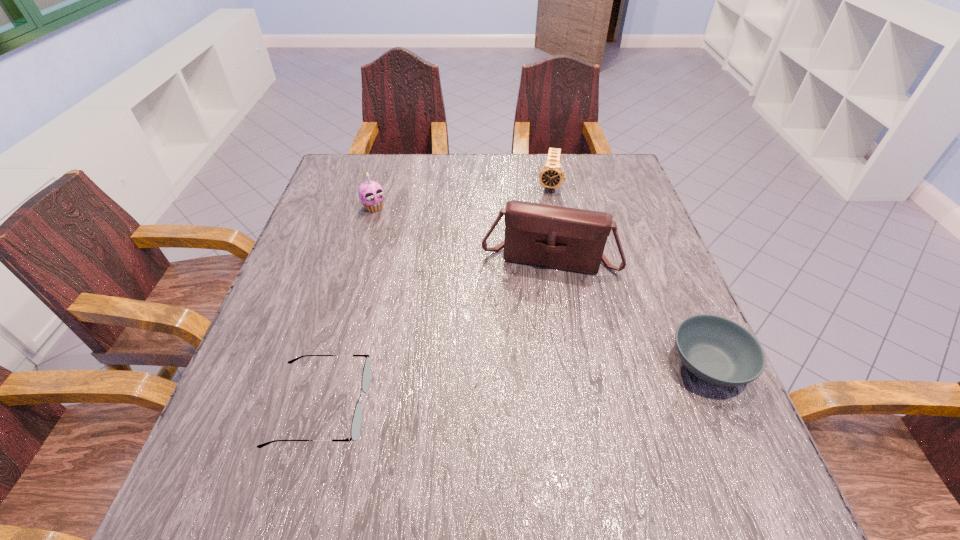
Identify the location of spectacles. (366, 375).

Locate an element on the screen. The height and width of the screenshot is (540, 960). soup bowl is located at coordinates (717, 350).

Where is `the farthest object`? The height and width of the screenshot is (540, 960). the farthest object is located at coordinates (551, 175).

You are a GUI agent. You are given a task and a screenshot of the screen. Output one action in this format:
    pyautogui.click(x=<x>, y=<y>)
    Task: Click on the second farthest object
    Image resolution: width=960 pixels, height=540 pixels.
    Given the screenshot: What is the action you would take?
    pyautogui.click(x=371, y=194)

I want to click on shoulder bag, so click(564, 238).

You are a GUI agent. You are given a task and a screenshot of the screen. Output one action in this format:
    pyautogui.click(x=<x>, y=<y>)
    Task: Click on the tallest object
    The width and height of the screenshot is (960, 540).
    Given the screenshot: What is the action you would take?
    pyautogui.click(x=564, y=238)

The height and width of the screenshot is (540, 960). I want to click on vacant space positioned on the lenses of the spectacles, so click(x=506, y=406).

Find the location of a particular element. This screenshot has height=540, width=960. vacant space located on the back of the soup bowl is located at coordinates (657, 244).

Locate an element on the screen. The width and height of the screenshot is (960, 540). vacant region located on the face of the watch is located at coordinates (545, 213).

This screenshot has height=540, width=960. Identify the location of vacant space located 0.240m on the face of the watch. (540, 251).